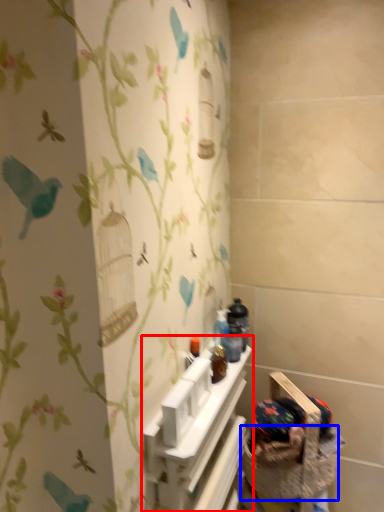
Question: Which point is closer to the camera, shelf (highlighted by a red box) or basket container (highlighted by a blue box)?

Choices:
 (A) shelf
 (B) basket container

Answer: (A)